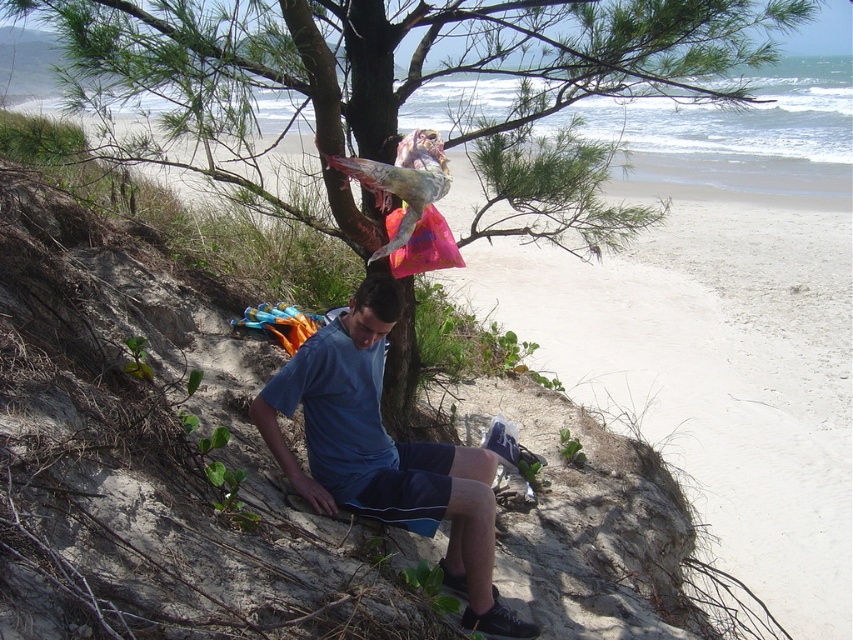
You are a hiker who has just arrived at the beach scene described. You need to find the green leafy tree at center to set up your equipment. According to the coordinates provided, where exactly should you look for it?

The green leafy tree at center is located at point (418, 83), so you should look there to find it.

You are a hiker who has just arrived at the beach. You see the green leafy tree at center and the blue fabric shorts at center. Which object is higher up in the scene?

The green leafy tree at center is located above the blue fabric shorts at center, so the green leafy tree at center is higher up in the scene.